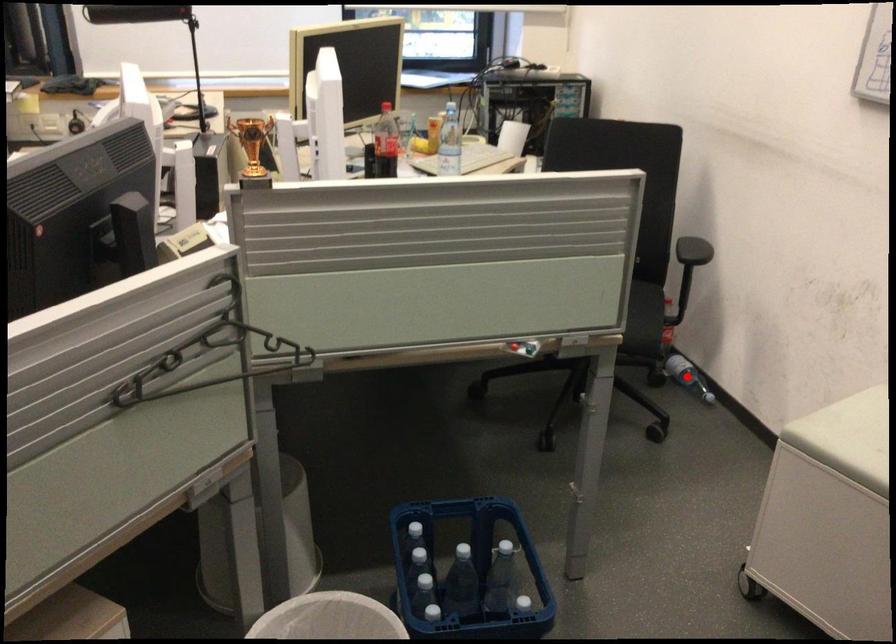
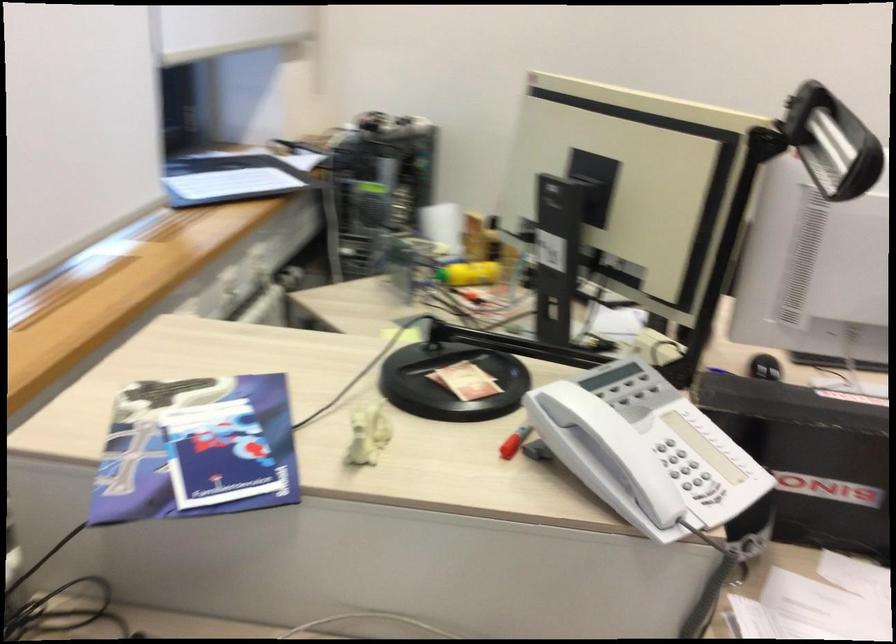
Question: I am providing you with two images of the same scene from different viewpoints. A red point is marked on the first image. Is the red point's position out of view in image 2?

Choices:
 (A) Yes
 (B) No

Answer: (A)